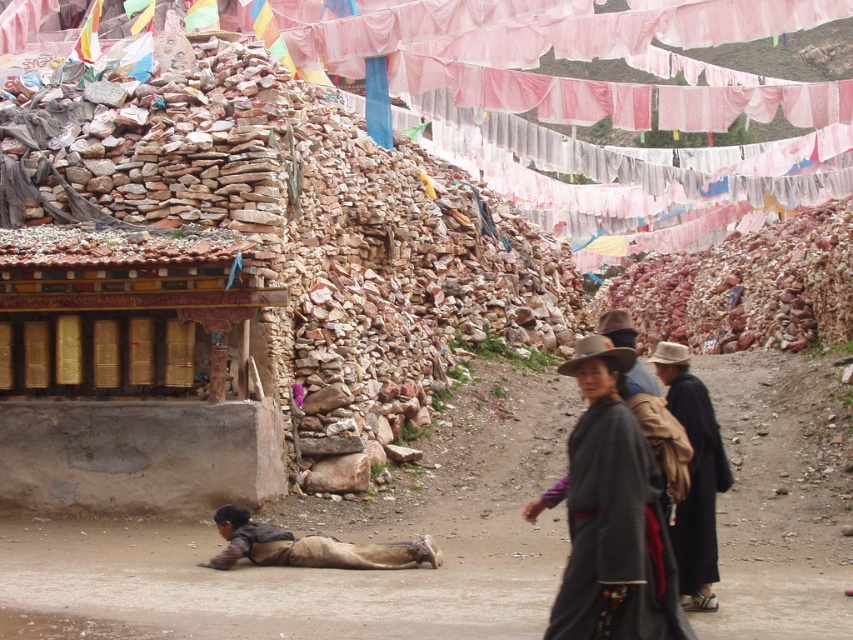
Can you confirm if dark gray woolen robe at center is wider than white felt cowboy hat at center?

No, dark gray woolen robe at center is not wider than white felt cowboy hat at center.

Does dark gray woolen robe at center appear under white felt cowboy hat at center?

Yes, dark gray woolen robe at center is below white felt cowboy hat at center.

Which is in front, point (671, 611) or point (672, 353)?

Positioned in front is point (671, 611).

This screenshot has width=853, height=640. I want to click on dark gray woolen robe at center, so click(614, 536).

Measure the distance from dark gray woolen robe at center to brown felt cowboy hat at center.

dark gray woolen robe at center and brown felt cowboy hat at center are 9.32 meters apart from each other.

Between dark gray woolen robe at center and brown felt cowboy hat at center, which one has more height?

dark gray woolen robe at center

Which is in front, point (608, 461) or point (573, 374)?

Point (608, 461)

Image resolution: width=853 pixels, height=640 pixels. Identify the location of dark gray woolen robe at center. (614, 536).

Between point (134, 451) and point (590, 500), which one is positioned in front?

Point (590, 500) is more forward.

Does gold metallic prayer wheel at lower left appear over dark gray woolen robe at center?

Yes, gold metallic prayer wheel at lower left is above dark gray woolen robe at center.

Who is more distant from viewer, (221, 326) or (595, 566)?

The point (221, 326) is more distant.

Locate an element on the screen. gold metallic prayer wheel at lower left is located at coordinates (132, 371).